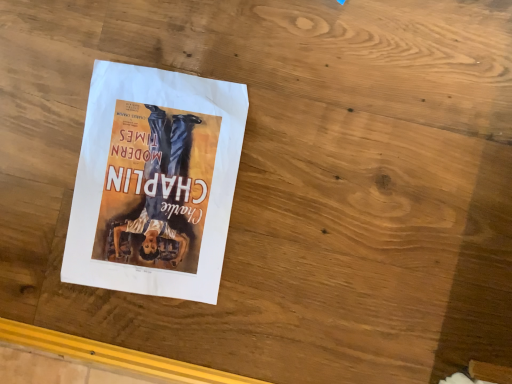
Identify the location of free point above white paper poster at center (from a real-world perspective). This screenshot has height=384, width=512. (146, 184).